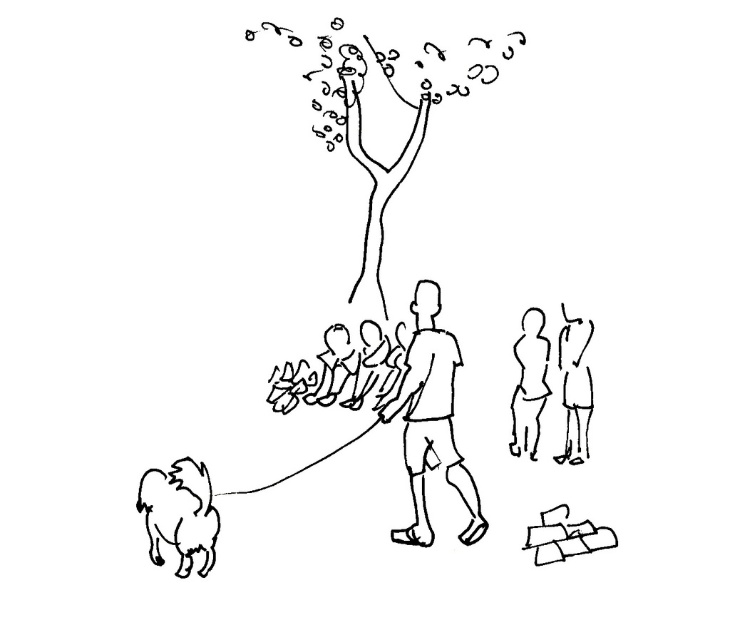
Is point (426, 92) positioned behind point (407, 448)?

Yes, point (426, 92) is farther from viewer.

Is smooth black tree at upper center above smooth skin figure at center?

Yes.

Image resolution: width=730 pixels, height=640 pixels. Find the location of `smooth black tree at upper center`. smooth black tree at upper center is located at coordinates (391, 115).

What are the coordinates of `smooth black tree at upper center` in the screenshot? It's located at (391, 115).

Which is in front, point (474, 497) or point (534, 433)?

Positioned in front is point (474, 497).

Which is more to the left, smooth skin figure at center or smooth skin child at right?

smooth skin figure at center is more to the left.

Between point (396, 540) and point (534, 428), which one is positioned behind?

The point (534, 428) is more distant.

The height and width of the screenshot is (640, 730). I want to click on smooth skin figure at center, so click(430, 419).

Which is below, smooth black tree at upper center or smooth skin figure at right?

Positioned lower is smooth skin figure at right.

This screenshot has width=730, height=640. I want to click on smooth black tree at upper center, so click(391, 115).